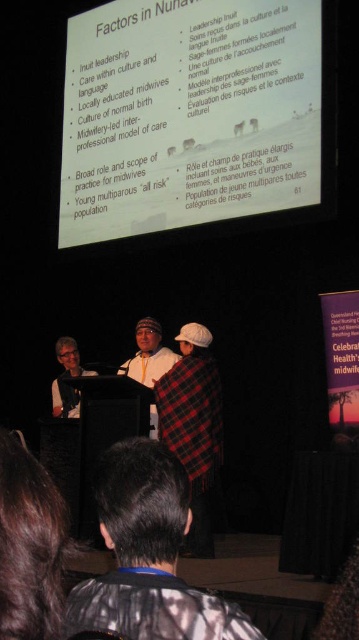
Question: Where is white matte projector screen at upper center located in relation to dark gray jacket at lower center in the image?

Choices:
 (A) above
 (B) below

Answer: (A)

Question: From the image, what is the correct spatial relationship of plaid fabric blanket at center in relation to plaid fabric hat at center?

Choices:
 (A) left
 (B) right

Answer: (B)

Question: Which object is the closest to the dark gray jacket at lower center?

Choices:
 (A) plaid fabric blanket at center
 (B) plaid fabric hat at center

Answer: (A)

Question: Which point is closer to the camera?

Choices:
 (A) (306, 122)
 (B) (224, 625)

Answer: (B)

Question: Is dark gray jacket at lower center bigger than plaid fabric blanket at center?

Choices:
 (A) yes
 (B) no

Answer: (B)

Question: Estimate the real-world distances between objects in this image. Which object is farther from the white matte projector screen at upper center?

Choices:
 (A) plaid fabric blanket at center
 (B) plaid fabric hat at center
 (C) dark gray jacket at lower center

Answer: (C)